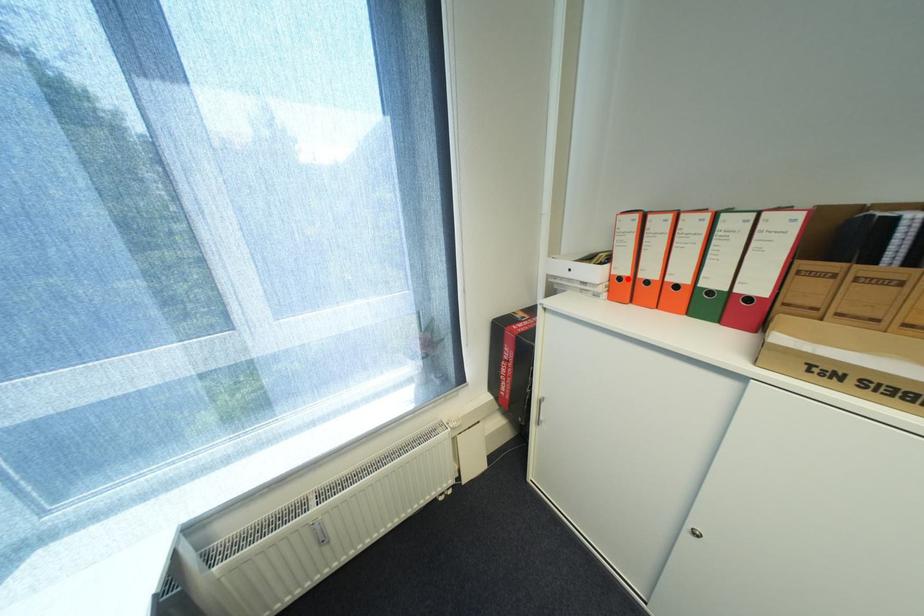
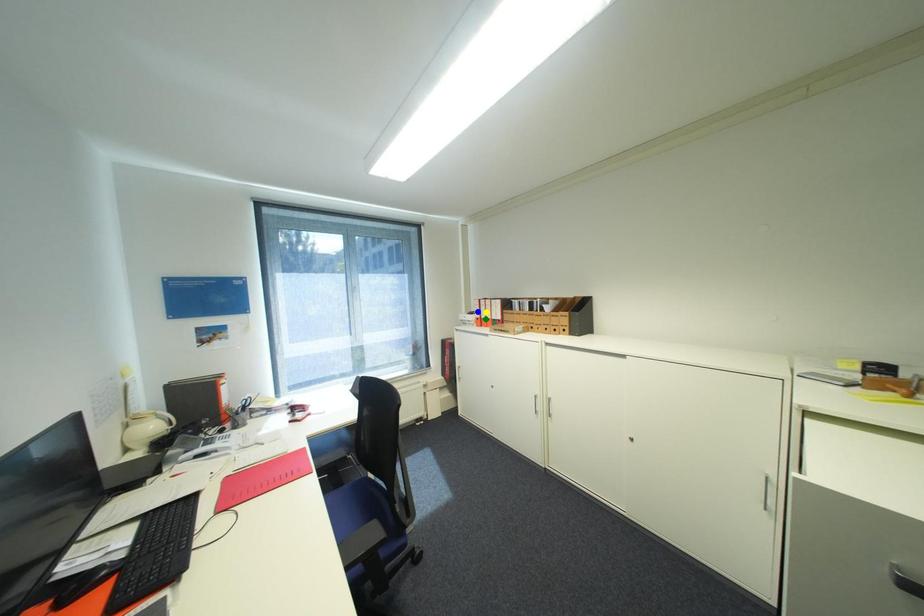
Question: I am providing you with two images of the same scene from different viewpoints. A red point is marked on the first image. You are given multiple points on the second image. Which point in image 2 represents the same 3d spot as the red point in image 1?

Choices:
 (A) blue point
 (B) green point
 (C) yellow point

Answer: (B)